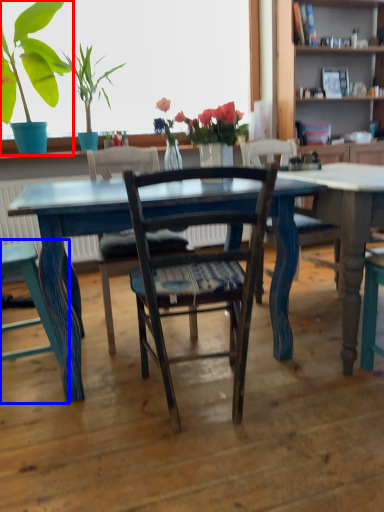
Question: Which of the following is the closest to the observer, houseplant (highlighted by a red box) or chair (highlighted by a blue box)?

Choices:
 (A) houseplant
 (B) chair

Answer: (B)